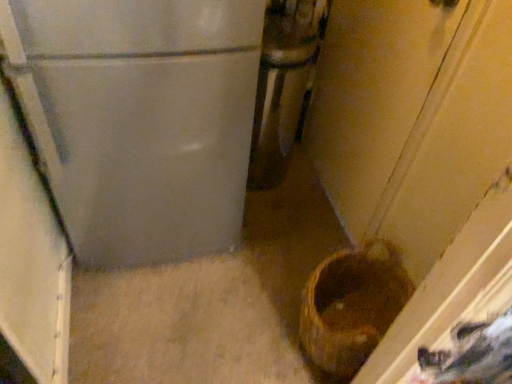
Question: Should I look upward or downward to see brown woven basket at lower right?

Choices:
 (A) down
 (B) up

Answer: (A)

Question: Does brown woven basket at lower right appear on the right side of metallic silver refrigerator at center?

Choices:
 (A) yes
 (B) no

Answer: (A)

Question: Can you confirm if brown woven basket at lower right is wider than metallic silver refrigerator at center?

Choices:
 (A) yes
 (B) no

Answer: (B)

Question: Is there a large distance between brown woven basket at lower right and metallic silver refrigerator at center?

Choices:
 (A) no
 (B) yes

Answer: (A)

Question: Does brown woven basket at lower right have a lesser width compared to metallic silver refrigerator at center?

Choices:
 (A) yes
 (B) no

Answer: (A)

Question: Does brown woven basket at lower right lie behind metallic silver refrigerator at center?

Choices:
 (A) yes
 (B) no

Answer: (B)

Question: Considering the relative sizes of brown woven basket at lower right and metallic silver refrigerator at center in the image provided, is brown woven basket at lower right shorter than metallic silver refrigerator at center?

Choices:
 (A) yes
 (B) no

Answer: (A)

Question: Does metallic silver refrigerator at center touch brown woven basket at lower right?

Choices:
 (A) no
 (B) yes

Answer: (A)

Question: Considering the relative sizes of metallic silver refrigerator at center and brown woven basket at lower right in the image provided, is metallic silver refrigerator at center shorter than brown woven basket at lower right?

Choices:
 (A) no
 (B) yes

Answer: (A)

Question: Considering the relative sizes of metallic silver refrigerator at center and brown woven basket at lower right in the image provided, is metallic silver refrigerator at center thinner than brown woven basket at lower right?

Choices:
 (A) no
 (B) yes

Answer: (A)

Question: Is metallic silver refrigerator at center positioned before brown woven basket at lower right?

Choices:
 (A) no
 (B) yes

Answer: (A)

Question: Is metallic silver refrigerator at center not within brown woven basket at lower right?

Choices:
 (A) yes
 (B) no

Answer: (A)

Question: Is metallic silver refrigerator at center taller than brown woven basket at lower right?

Choices:
 (A) yes
 (B) no

Answer: (A)

Question: In terms of height, does metallic silver refrigerator at center look taller or shorter compared to brown woven basket at lower right?

Choices:
 (A) short
 (B) tall

Answer: (B)